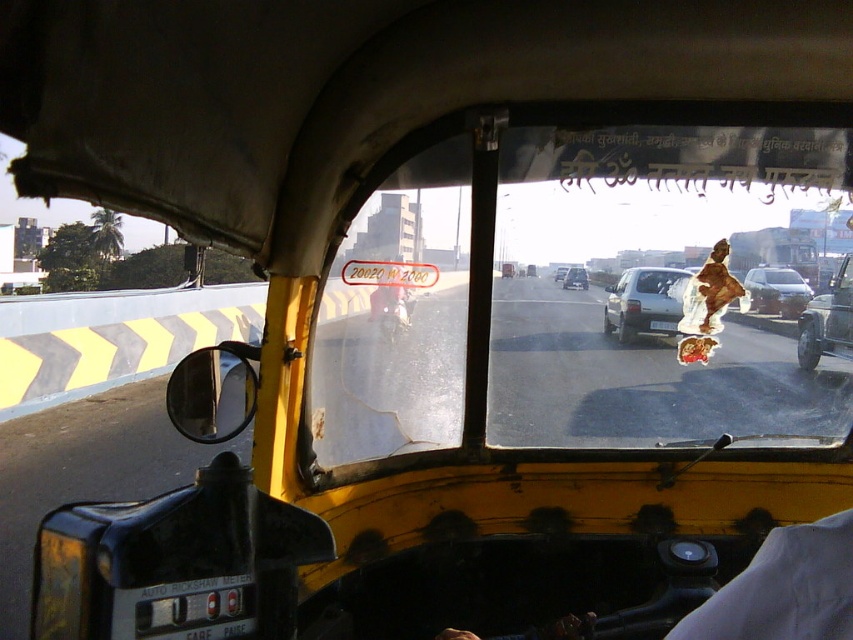
Is matte silver car at center smaller than metallic silver car at right?

Correct, matte silver car at center occupies less space than metallic silver car at right.

Between point (659, 332) and point (842, 307), which one is positioned in front?

Point (659, 332) is more forward.

Who is more distant from viewer, (654,300) or (798,326)?

The point (798,326) is behind.

You are a GUI agent. You are given a task and a screenshot of the screen. Output one action in this format:
    pyautogui.click(x=<x>, y=<y>)
    Task: Click on the matte silver car at center
    
    Given the screenshot: What is the action you would take?
    pyautogui.click(x=645, y=301)

Based on the photo, can you confirm if transparent plastic windshield at center is smaller than metallic silver car at right?

Incorrect, transparent plastic windshield at center is not smaller in size than metallic silver car at right.

Does transparent plastic windshield at center have a lesser height compared to metallic silver car at right?

Incorrect, transparent plastic windshield at center's height does not fall short of metallic silver car at right's.

The image size is (853, 640). In order to click on transparent plastic windshield at center in this screenshot , I will do `click(650, 266)`.

You are a GUI agent. You are given a task and a screenshot of the screen. Output one action in this format:
    pyautogui.click(x=<x>, y=<y>)
    Task: Click on the transparent plastic windshield at center
    
    Given the screenshot: What is the action you would take?
    pyautogui.click(x=650, y=266)

Between metallic silver car at right and silver metallic sedan at center, which one has less height?

Standing shorter between the two is silver metallic sedan at center.

Based on the photo, is metallic silver car at right positioned behind silver metallic sedan at center?

No.

Where is `metallic silver car at right`? metallic silver car at right is located at coordinates (827, 321).